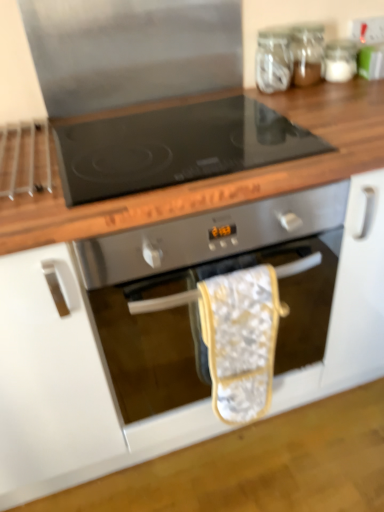
Identify the location of vacant space situated on the left part of transparent glass jar at upper right, the first glass jar from the left. This screenshot has width=384, height=512. (224, 99).